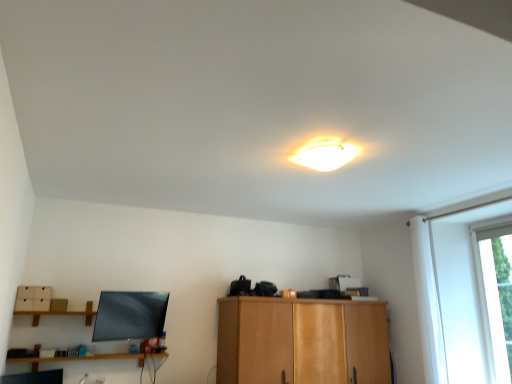
Measure the distance between point [356,150] and camera.

The depth of point [356,150] is 9.60 feet.

Identify the location of wooden cabinet at center. This screenshot has height=384, width=512. (302, 341).

Based on the photo, from a real-world perspective, is wooden shelf at lower left positioned above or below white glossy ceiling light at upper center?

wooden shelf at lower left is below white glossy ceiling light at upper center.

From the image's perspective, who appears lower, wooden shelf at lower left or white glossy ceiling light at upper center?

wooden shelf at lower left, from the image's perspective.

Which of these two, wooden shelf at lower left or white glossy ceiling light at upper center, is smaller?

Smaller between the two is white glossy ceiling light at upper center.

Considering the positions of objects white glossy ceiling light at upper center and transparent glass window at right in the image provided, who is behind, white glossy ceiling light at upper center or transparent glass window at right?

transparent glass window at right is more distant.

Is white glossy ceiling light at upper center to the left of transparent glass window at right from the viewer's perspective?

Yes, white glossy ceiling light at upper center is to the left of transparent glass window at right.

Can you confirm if white glossy ceiling light at upper center is smaller than transparent glass window at right?

Incorrect, white glossy ceiling light at upper center is not smaller in size than transparent glass window at right.

Does wooden shelf at lower left have a larger size compared to wooden cabinet at center?

Incorrect, wooden shelf at lower left is not larger than wooden cabinet at center.

Considering their positions, is wooden shelf at lower left located in front of or behind wooden cabinet at center?

In the image, wooden shelf at lower left appears in front of wooden cabinet at center.

Is wooden shelf at lower left with wooden cabinet at center?

They are not placed beside each other.

From a real-world perspective, who is located lower, wooden shelf at lower left or wooden cabinet at center?

wooden shelf at lower left is physically lower.

Could you tell me if white glossy ceiling light at upper center is facing wooden shelf at lower left?

No, white glossy ceiling light at upper center is not turned towards wooden shelf at lower left.

Can you confirm if white glossy ceiling light at upper center is bigger than wooden shelf at lower left?

No.

Considering the positions of objects white glossy ceiling light at upper center and wooden shelf at lower left in the image provided, who is behind, white glossy ceiling light at upper center or wooden shelf at lower left?

Positioned behind is wooden shelf at lower left.

Does wooden shelf at lower left turn towards transparent glass window at right?

No, wooden shelf at lower left does not turn towards transparent glass window at right.

Considering the relative sizes of wooden shelf at lower left and transparent glass window at right in the image provided, is wooden shelf at lower left thinner than transparent glass window at right?

No.

Looking at the image, does wooden shelf at lower left seem bigger or smaller compared to transparent glass window at right?

In the image, wooden shelf at lower left appears to be larger than transparent glass window at right.

Consider the image. How different are the orientations of wooden shelf at lower left and transparent glass window at right in degrees?

There is a 91.8-degree angle between the facing directions of wooden shelf at lower left and transparent glass window at right.

Based on the photo, is transparent glass window at right turned away from wooden cabinet at center?

No, transparent glass window at right is not facing the opposite direction of wooden cabinet at center.

How distant is transparent glass window at right from wooden cabinet at center?

A distance of 1.60 meters exists between transparent glass window at right and wooden cabinet at center.

Is point (496, 267) positioned behind point (247, 335)?

Yes, point (496, 267) is behind point (247, 335).

From the picture: Between transparent glass window at right and wooden cabinet at center, which one has more height?

transparent glass window at right.

Looking at this image, between transparent glass window at right and white glossy ceiling light at upper center, which one has less height?

white glossy ceiling light at upper center.

Considering the positions of objects transparent glass window at right and white glossy ceiling light at upper center in the image provided, who is more to the left, transparent glass window at right or white glossy ceiling light at upper center?

From the viewer's perspective, white glossy ceiling light at upper center appears more on the left side.

From the image's perspective, between transparent glass window at right and white glossy ceiling light at upper center, who is located below?

transparent glass window at right appears lower in the image.

Locate an element on the screen. The image size is (512, 384). lamp above the wooden shelf at lower left (from a real-world perspective) is located at coordinates (325, 154).

Where is `window behind the white glossy ceiling light at upper center`? The height and width of the screenshot is (384, 512). window behind the white glossy ceiling light at upper center is located at coordinates (496, 296).

Looking at the image, which one is located closer to wooden shelf at lower left, white glossy ceiling light at upper center or wooden cabinet at center?

Among the two, wooden cabinet at center is located nearer to wooden shelf at lower left.

Based on their spatial positions, is wooden cabinet at center or white glossy ceiling light at upper center further from wooden shelf at lower left?

white glossy ceiling light at upper center is further to wooden shelf at lower left.

When comparing their distances from transparent glass window at right, does wooden shelf at lower left or white glossy ceiling light at upper center seem further?

wooden shelf at lower left.

Considering their positions, is wooden shelf at lower left positioned further to white glossy ceiling light at upper center than wooden cabinet at center?

Among the two, wooden shelf at lower left is located further to white glossy ceiling light at upper center.

When comparing their distances from transparent glass window at right, does wooden cabinet at center or wooden shelf at lower left seem closer?

The object closer to transparent glass window at right is wooden cabinet at center.

Which object lies nearer to the anchor point white glossy ceiling light at upper center, wooden cabinet at center or transparent glass window at right?

Based on the image, wooden cabinet at center appears to be nearer to white glossy ceiling light at upper center.

Based on their spatial positions, is transparent glass window at right or white glossy ceiling light at upper center further from wooden cabinet at center?

The object further to wooden cabinet at center is white glossy ceiling light at upper center.

Which object lies nearer to the anchor point wooden shelf at lower left, wooden cabinet at center or transparent glass window at right?

wooden cabinet at center lies closer to wooden shelf at lower left than the other object.

The image size is (512, 384). What are the coordinates of `lamp between wooden shelf at lower left and wooden cabinet at center` in the screenshot? It's located at pyautogui.click(x=325, y=154).

You are a GUI agent. You are given a task and a screenshot of the screen. Output one action in this format:
    pyautogui.click(x=<x>, y=<y>)
    Task: Click on the cabinetry between white glossy ceiling light at upper center and transparent glass window at right from left to right
    
    Given the screenshot: What is the action you would take?
    pyautogui.click(x=302, y=341)

Where is `lamp located between wooden shelf at lower left and transparent glass window at right in the left-right direction`? The height and width of the screenshot is (384, 512). lamp located between wooden shelf at lower left and transparent glass window at right in the left-right direction is located at coordinates (325, 154).

Find the location of `cabinetry between wooden shelf at lower left and transparent glass window at right in the horizontal direction`. cabinetry between wooden shelf at lower left and transparent glass window at right in the horizontal direction is located at coordinates (302, 341).